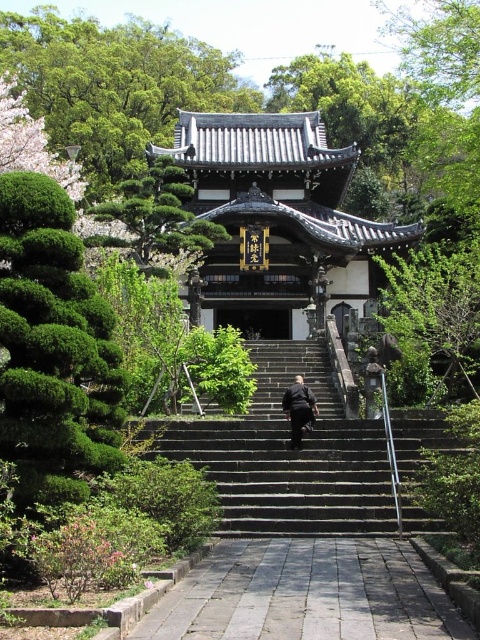
Based on the photo, is the position of dark gray stone stairs at center more distant than that of green leafy tree at upper center?

No.

Can you confirm if dark gray stone stairs at center is positioned below green leafy tree at upper center?

Yes.

Measure the distance between point (x=430, y=524) and camera.

They are 105.63 feet apart.

In order to click on dark gray stone stairs at center in this screenshot , I will do `click(288, 456)`.

Is point (327, 404) less distant than point (310, 541)?

No, it is not.

Between dark gray stone stairs at center and gray stone path at center, which one appears on the right side from the viewer's perspective?

Positioned to the right is gray stone path at center.

Describe the element at coordinates (288, 456) in the screenshot. I see `dark gray stone stairs at center` at that location.

Where is `dark gray stone stairs at center`? The image size is (480, 640). dark gray stone stairs at center is located at coordinates (288, 456).

How far apart are green leafy tree at upper center and dark gray suit at center?

The distance of green leafy tree at upper center from dark gray suit at center is 342.00 feet.

Is green leafy tree at upper center positioned in front of dark gray suit at center?

No, it is behind dark gray suit at center.

At what (x,y) coordinates should I click in order to perform the action: click on green leafy tree at upper center. Please return your answer as a coordinate pair (x, y). The height and width of the screenshot is (640, 480). Looking at the image, I should click on (115, 84).